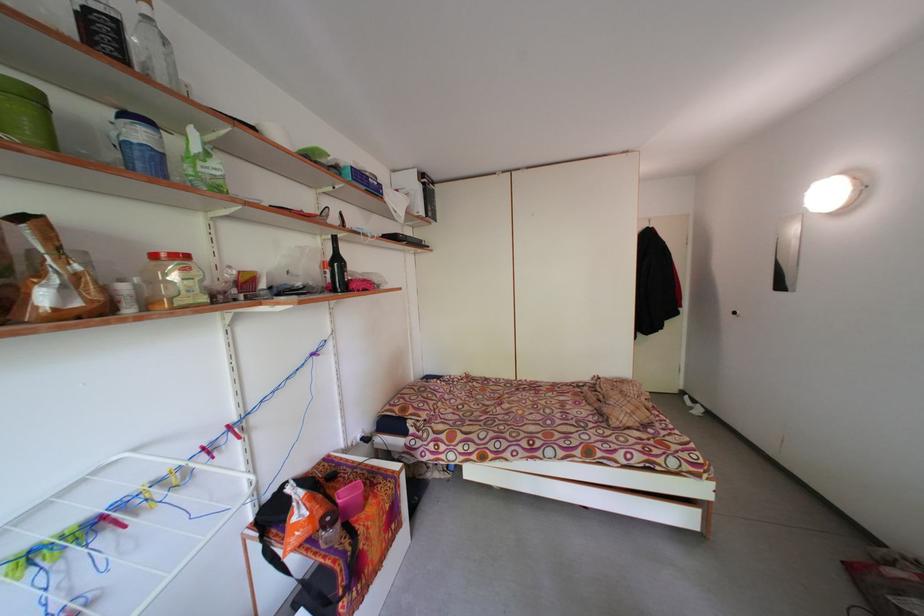
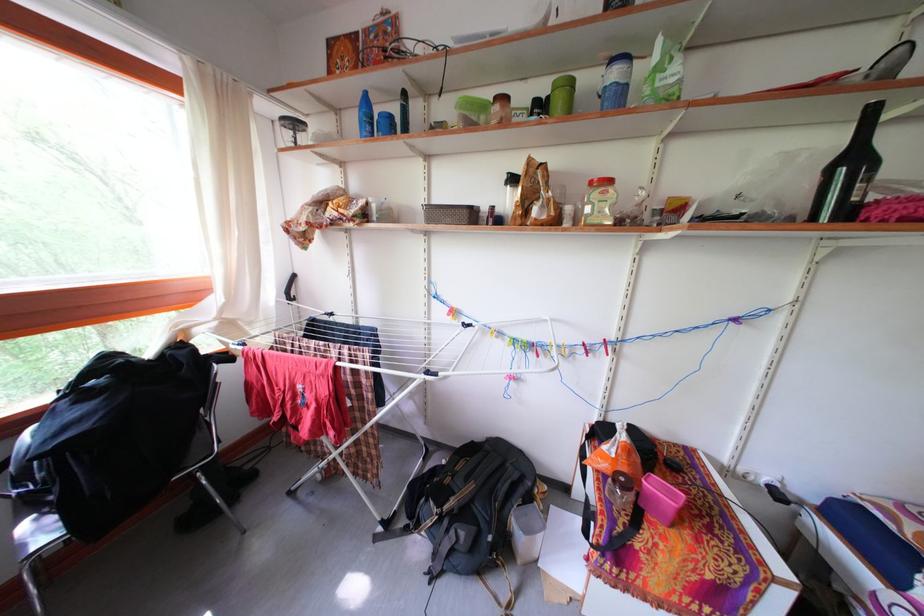
Locate, in the second image, the point that corresponds to (x=147, y=140) in the first image.

(623, 81)